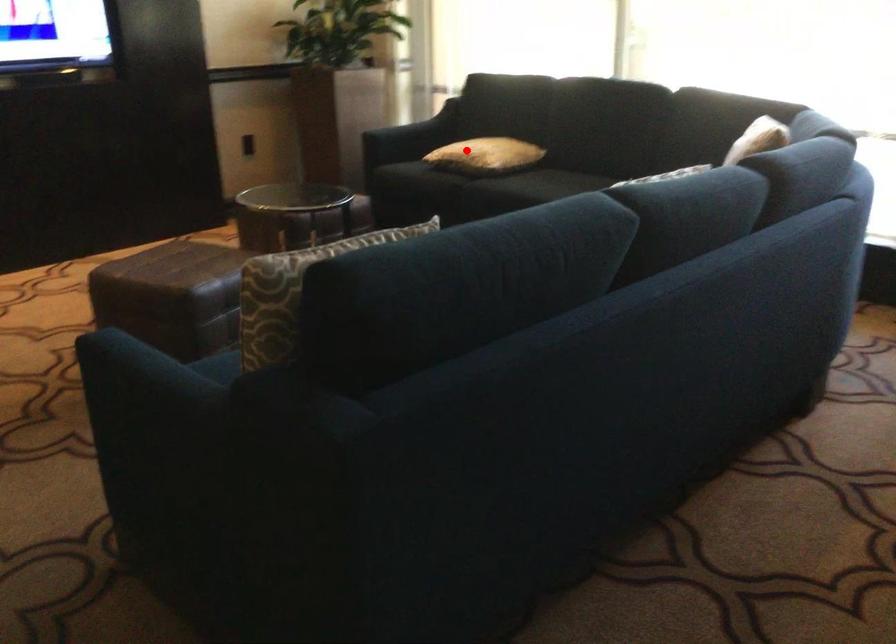
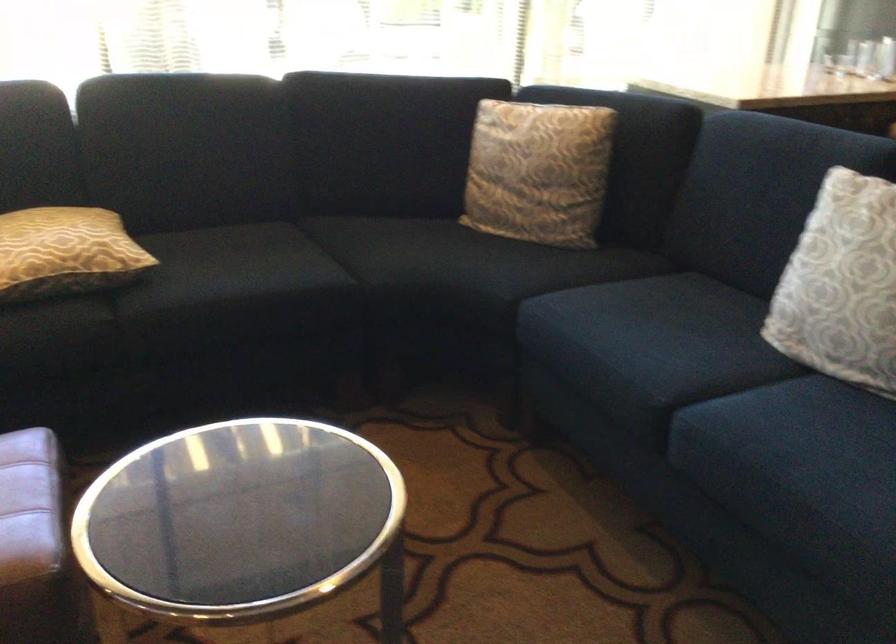
Question: A red point is marked in image1. In image2, is the corresponding 3D point closer to the camera or farther? Reply with the corresponding letter.

Choices:
 (A) The corresponding 3D point is closer.
 (B) The corresponding 3D point is farther.

Answer: (A)